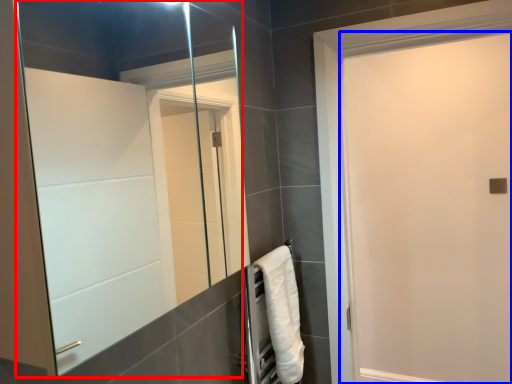
Question: Which of the following is the farthest to the observer, mirror (highlighted by a red box) or screen door (highlighted by a blue box)?

Choices:
 (A) mirror
 (B) screen door

Answer: (B)